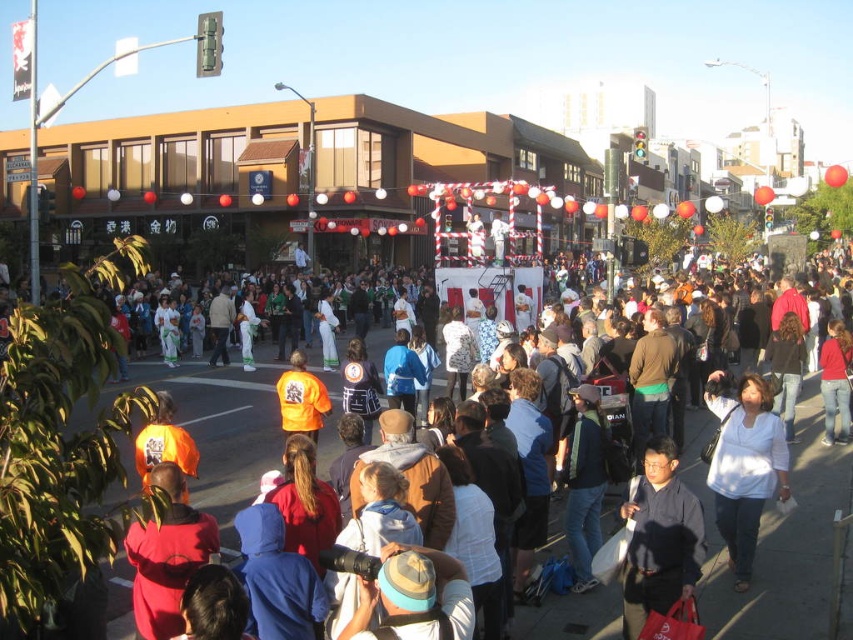
Question: Can you confirm if white paper float at center is positioned above orange reflective vest at center?

Choices:
 (A) no
 (B) yes

Answer: (B)

Question: Among these points, which one is nearest to the camera?

Choices:
 (A) (656, 458)
 (B) (264, 454)

Answer: (A)

Question: Is white paper float at center positioned before orange reflective vest at center?

Choices:
 (A) yes
 (B) no

Answer: (B)

Question: Which point appears farthest from the camera in this image?

Choices:
 (A) (726, 477)
 (B) (161, 488)
 (C) (636, 579)

Answer: (A)

Question: Does white paper float at center have a larger size compared to orange reflective vest at center?

Choices:
 (A) no
 (B) yes

Answer: (B)

Question: Based on their relative distances, which object is nearer to the dark gray shirt at center?

Choices:
 (A) white paper float at center
 (B) orange reflective vest at center

Answer: (A)